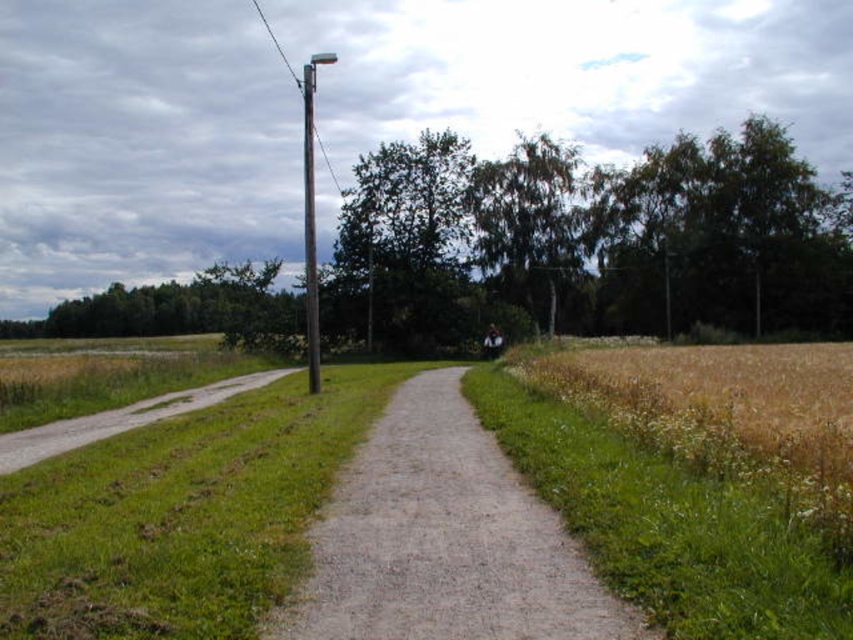
You are a photographer planning to take a photo of the brown wooden telegraph pole at upper center and the metallic pole at center. Based on their positions, which pole would appear larger in the photo?

The brown wooden telegraph pole at upper center is above the metallic pole at center, so it would appear smaller in the photo due to its higher position, while the metallic pole at center, being lower, would appear larger.

You are standing at the center of the image and want to walk to the gravel path at lower left. In which direction should you move relative to your current position?

The gravel path at lower left is located at point (119, 419), so you should move towards the lower left direction to reach it.

You are a hiker walking along the dirt path and want to reach the metallic pole at center. Which direction should you walk to get closer to it first, considering the brown wooden telegraph pole at upper center is in your way?

You should walk towards the metallic pole at center, but first you need to go around the brown wooden telegraph pole at upper center since it is closer to you and blocking the path.